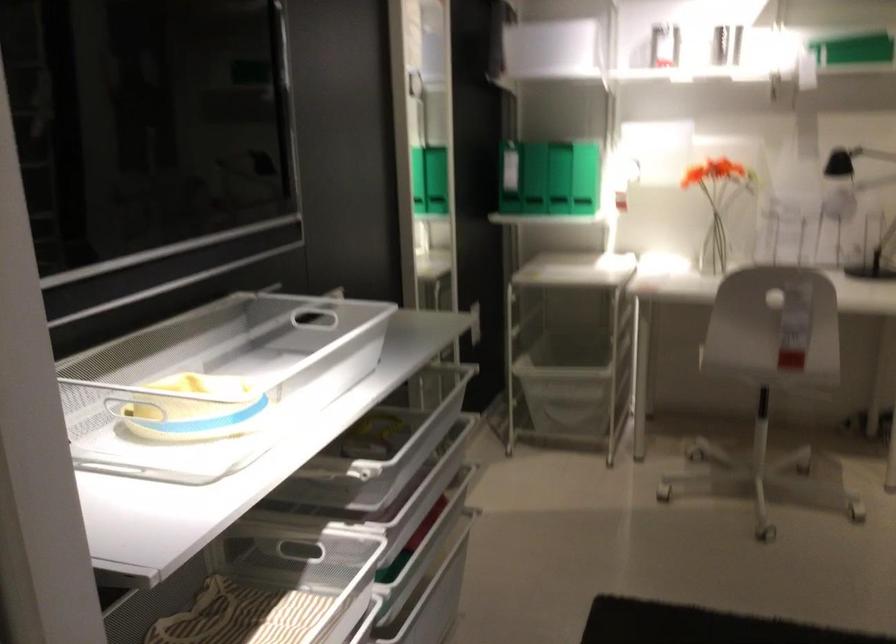
The location [216,383] corresponds to which object?

This point indicates the white mesh basket.